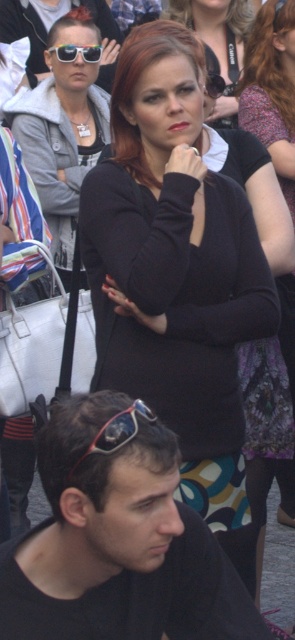
Question: Which object is positioned farthest from the black jersey at center?

Choices:
 (A) red plastic sunglasses at lower left
 (B) black matte dress at center
 (C) matte black top at center
 (D) matte black sunglasses at center

Answer: (A)

Question: Does black matte dress at center lie behind matte black sunglasses at center?

Choices:
 (A) no
 (B) yes

Answer: (A)

Question: Which object appears closest to the camera in this image?

Choices:
 (A) matte black top at center
 (B) matte black sunglasses at center
 (C) black matte sunglasses at lower left

Answer: (C)

Question: Which object appears farthest from the camera in this image?

Choices:
 (A) matte black shirt at center
 (B) black jersey at center
 (C) matte black sunglasses at center
 (D) black matte dress at center

Answer: (C)

Question: Can you confirm if black matte sunglasses at lower left is positioned to the right of matte black sunglasses at center?

Choices:
 (A) yes
 (B) no

Answer: (A)

Question: Is matte black shirt at center further to the viewer compared to matte black sunglasses at upper left?

Choices:
 (A) yes
 (B) no

Answer: (B)